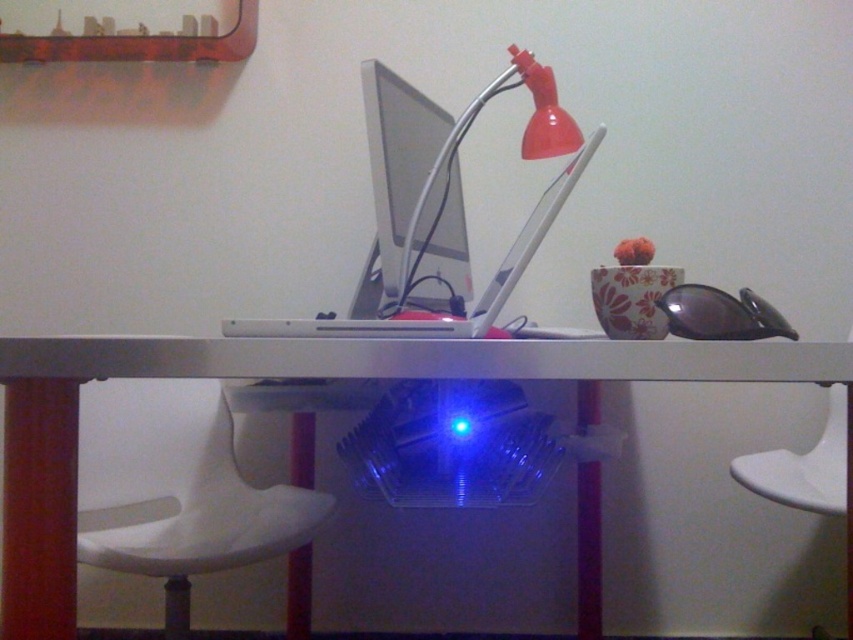
Between white plastic chair at lower left and matte plastic lamp at upper center, which one has more height?

With more height is matte plastic lamp at upper center.

Does white plastic chair at lower left have a greater width compared to matte plastic lamp at upper center?

Indeed, white plastic chair at lower left has a greater width compared to matte plastic lamp at upper center.

Is point (271, 506) positioned after point (548, 88)?

That is True.

I want to click on white plastic chair at lower left, so click(x=184, y=492).

How distant is transparent plastic tray at center from sleek silver laptop at center?

13.57 inches

Is transparent plastic tray at center smaller than sleek silver laptop at center?

Incorrect, transparent plastic tray at center is not smaller in size than sleek silver laptop at center.

Is point (137, 344) closer to camera compared to point (415, 216)?

Yes, it is.

The height and width of the screenshot is (640, 853). I want to click on transparent plastic tray at center, so click(299, 376).

Looking at this image, is white plastic chair at lower left closer to camera compared to satin silver monitor at center?

No, it is behind satin silver monitor at center.

Is white plastic chair at lower left thinner than satin silver monitor at center?

No.

Identify the location of white plastic chair at lower left. The width and height of the screenshot is (853, 640). (184, 492).

At what (x,y) coordinates should I click in order to perform the action: click on white plastic chair at lower left. Please return your answer as a coordinate pair (x, y). Looking at the image, I should click on (184, 492).